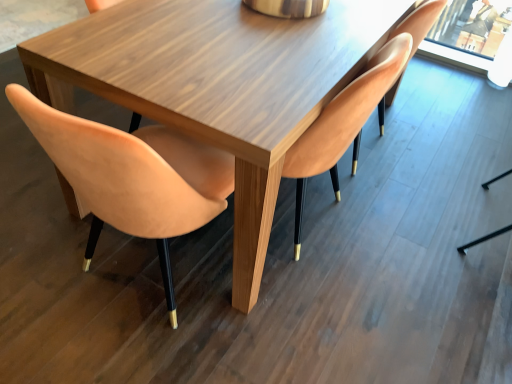
Find the location of a particular element. free region under suede-like peach chair at left, which is counted as the first chair, starting from the left (from a real-world perspective) is located at coordinates (134, 281).